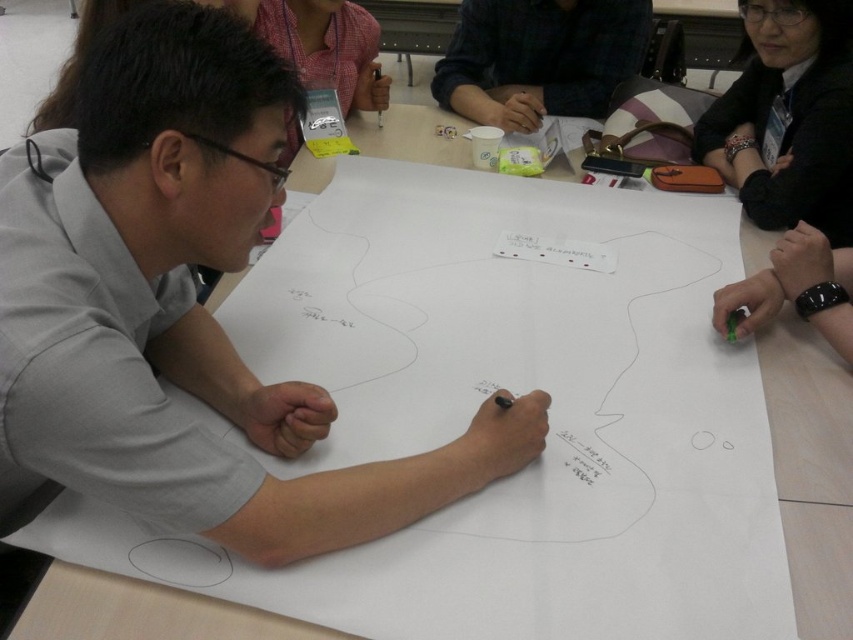
From the picture: Can you confirm if black leather jacket at upper right is bigger than dark plaid shirt at upper center?

Actually, black leather jacket at upper right might be smaller than dark plaid shirt at upper center.

Can you confirm if black leather jacket at upper right is wider than dark plaid shirt at upper center?

No, black leather jacket at upper right is not wider than dark plaid shirt at upper center.

Is point (759, 224) behind point (646, 45)?

No, (759, 224) is in front of (646, 45).

Identify the location of black leather jacket at upper right. This screenshot has height=640, width=853. (788, 116).